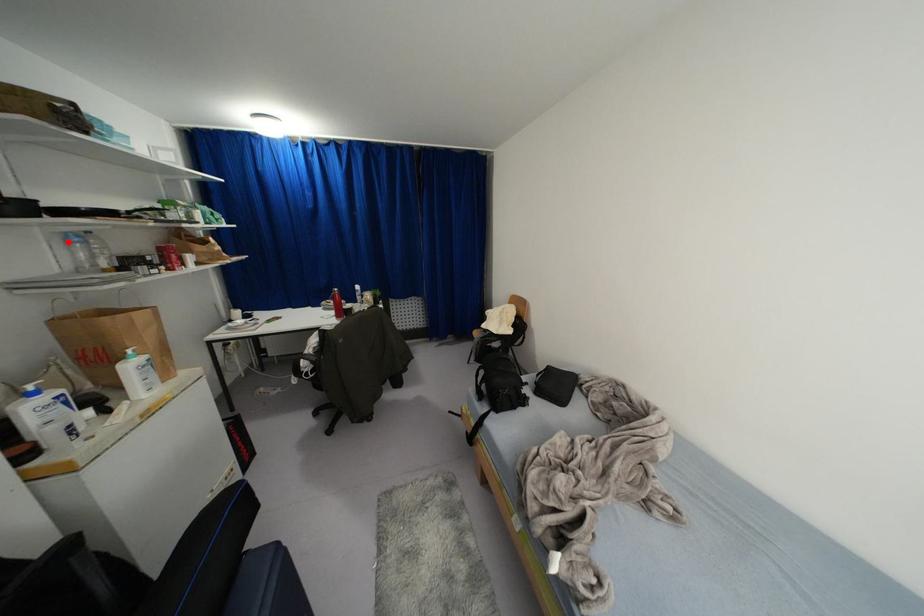
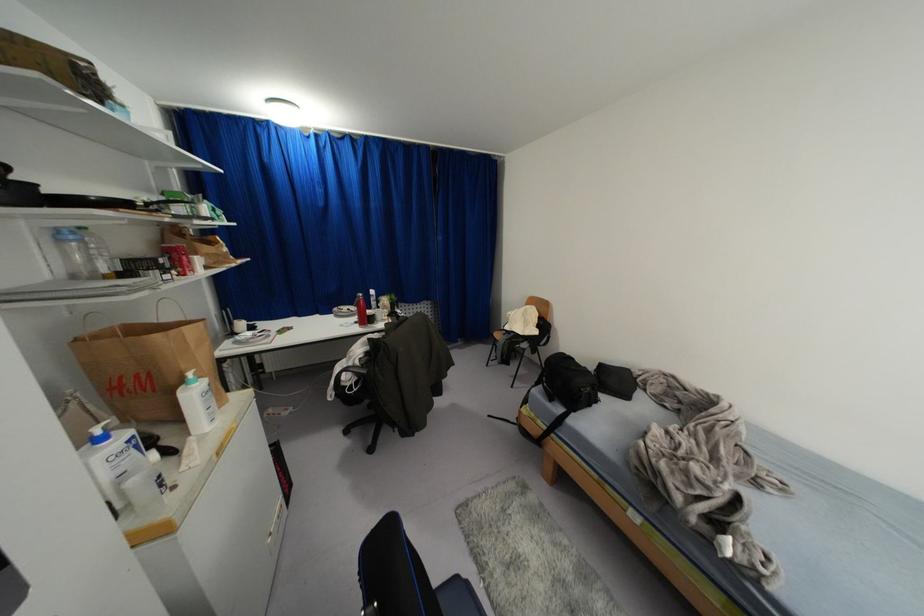
Where in the second image is the point corresponding to the highlighted location from the first image?

(62, 240)